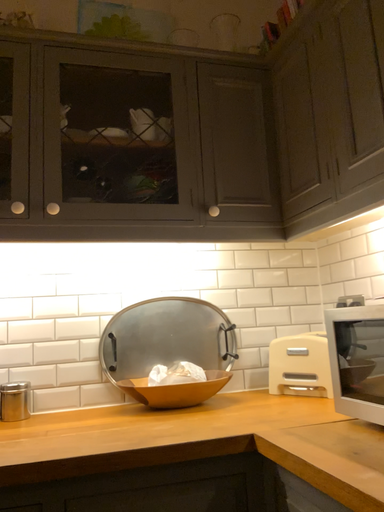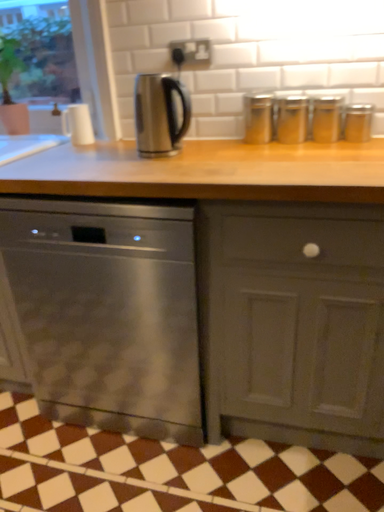
Question: Which way did the camera rotate in the video?

Choices:
 (A) rotated upward
 (B) rotated downward

Answer: (B)